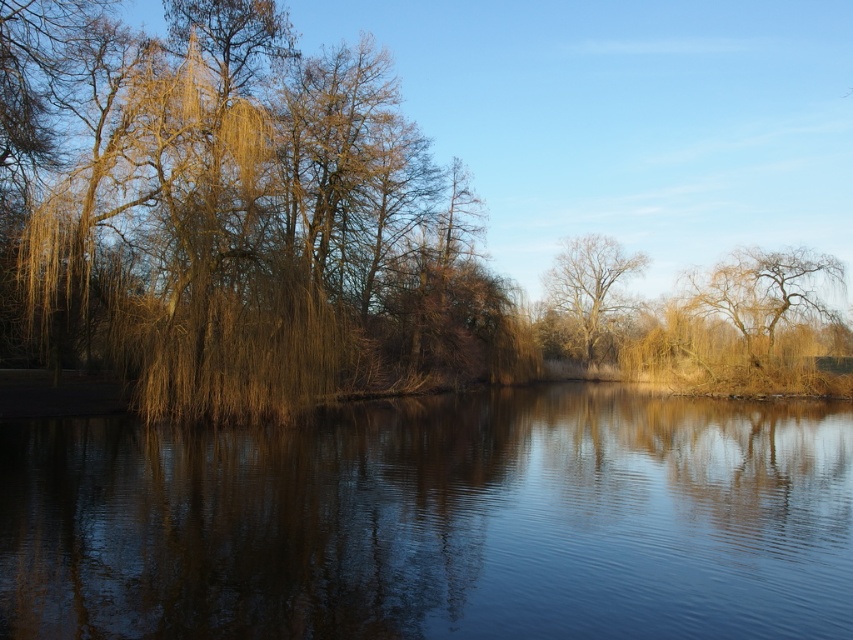
Who is more forward, (128, 570) or (573, 310)?

Positioned in front is point (128, 570).

Between smooth water at center and bare branches tree at center, which one has more height?

bare branches tree at center

You are a GUI agent. You are given a task and a screenshot of the screen. Output one action in this format:
    pyautogui.click(x=<x>, y=<y>)
    Task: Click on the smooth water at center
    This screenshot has width=853, height=640.
    Given the screenshot: What is the action you would take?
    pyautogui.click(x=436, y=522)

Who is more distant from viewer, (672,440) or (97,81)?

Positioned behind is point (97,81).

Based on the photo, is smooth water at center to the left of brown willow tree at left from the viewer's perspective?

Incorrect, smooth water at center is not on the left side of brown willow tree at left.

Which is in front, point (635, 481) or point (45, 253)?

Positioned in front is point (635, 481).

In order to click on smooth water at center in this screenshot , I will do `click(436, 522)`.

Between point (258, 387) and point (595, 278), which one is positioned in front?

Point (258, 387) is more forward.

Is brown willow tree at left shorter than bare branches tree at center?

Incorrect, brown willow tree at left's height does not fall short of bare branches tree at center's.

Measure the distance between brown willow tree at left and camera.

brown willow tree at left and camera are 22.44 meters apart from each other.

Find the location of a particular element. This screenshot has height=640, width=853. brown willow tree at left is located at coordinates (236, 220).